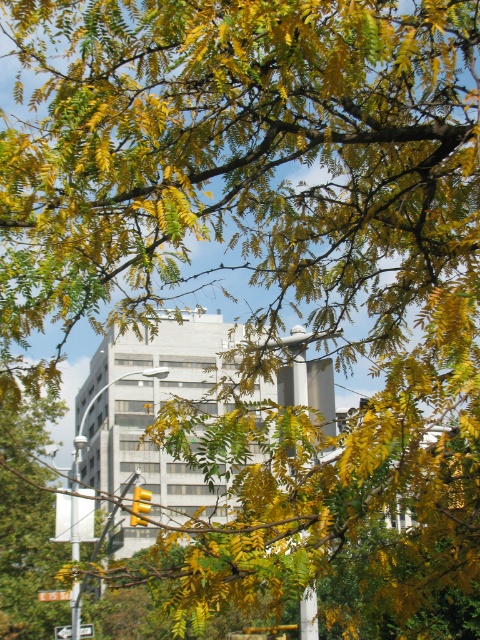
Question: Is metallic pole at left closer to camera compared to white plastic arrow at lower left?

Choices:
 (A) no
 (B) yes

Answer: (B)

Question: Does metallic pole at left come in front of white plastic arrow at lower left?

Choices:
 (A) yes
 (B) no

Answer: (A)

Question: Which point is closer to the camera?

Choices:
 (A) white plastic arrow at lower left
 (B) metallic pole at left

Answer: (B)

Question: Does metallic pole at left appear under white plastic arrow at lower left?

Choices:
 (A) yes
 (B) no

Answer: (B)